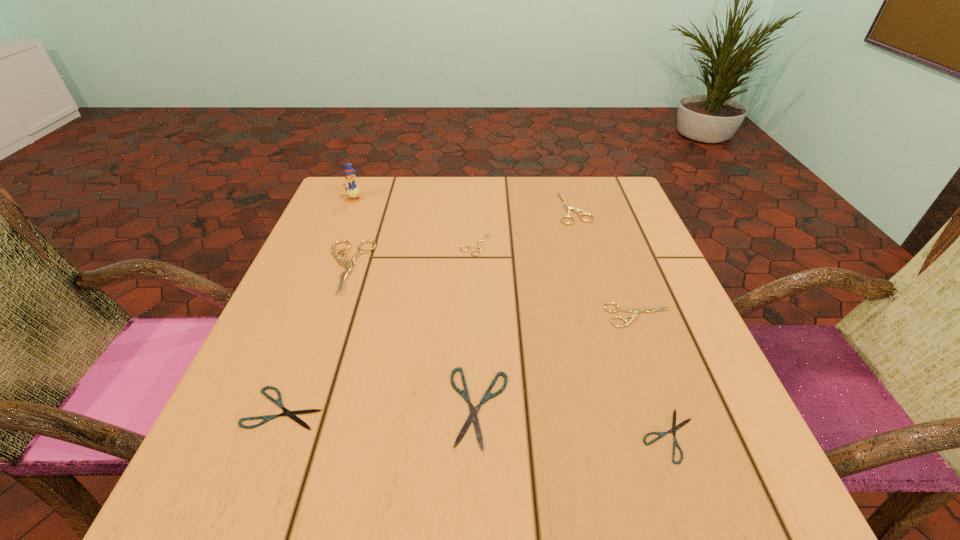
The image size is (960, 540). What are the coordinates of `unoccupied position between the leftmost beige shears and the shortest shears` in the screenshot? It's located at (509, 352).

Where is `free space between the biggest black shears and the yellow duckling`? This screenshot has width=960, height=540. free space between the biggest black shears and the yellow duckling is located at coordinates (417, 303).

Locate an element on the screen. The height and width of the screenshot is (540, 960). free space that is in between the tallest object and the sixth shortest object is located at coordinates (464, 204).

Identify which object is the nearest to the farthest beige shears. Please provide its 2D coordinates. Your answer should be formatted as a tuple, i.e. [(x, y)], where the tuple contains the x and y coordinates of a point satisfying the conditions above.

[(478, 244)]

Where is `the fifth closest object relative to the fourth nearest shears`? the fifth closest object relative to the fourth nearest shears is located at coordinates (349, 265).

Identify which shears is the fifth closest to the second biggest black shears. Please provide its 2D coordinates. Your answer should be formatted as a tuple, i.e. [(x, y)], where the tuple contains the x and y coordinates of a point satisfying the conditions above.

[(636, 311)]

Where is `the third closest shears relative to the fourth tallest object`? The height and width of the screenshot is (540, 960). the third closest shears relative to the fourth tallest object is located at coordinates pyautogui.click(x=478, y=244).

Where is `beige shears that is the third nearest to the yellow duckling`? beige shears that is the third nearest to the yellow duckling is located at coordinates (577, 210).

This screenshot has height=540, width=960. In order to click on beige shears object that ranks as the fourth closest to the second black shears from right to left in this screenshot , I will do `click(577, 210)`.

At what (x,y) coordinates should I click in order to perform the action: click on black shears that is the second closest one to the second black shears from right to left. Please return your answer as a coordinate pair (x, y). This screenshot has width=960, height=540. Looking at the image, I should click on (291, 414).